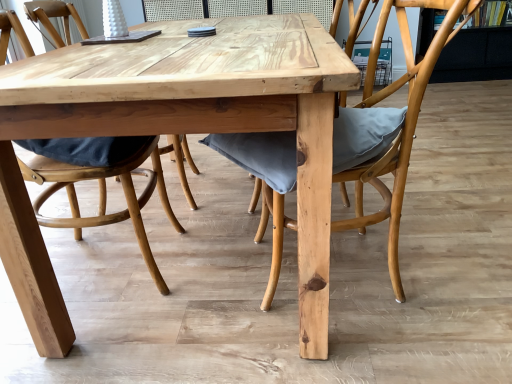
Locate an element on the screen. The height and width of the screenshot is (384, 512). free point in front of matte wood chair at center, which is counted as the first chair, starting from the left is located at coordinates (105, 341).